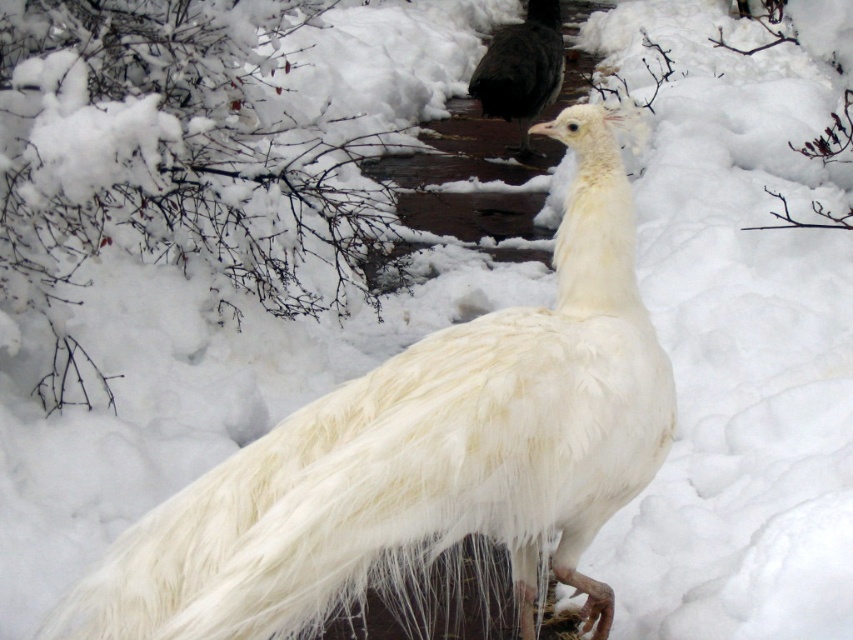
The height and width of the screenshot is (640, 853). I want to click on white feathered peacock at center, so click(x=422, y=452).

Between white feathered peacock at center and black glossy bird at center, which one is positioned higher?

black glossy bird at center

Who is more distant from viewer, [257,460] or [540,68]?

The point [540,68] is behind.

Locate an element on the screen. The width and height of the screenshot is (853, 640). white feathered peacock at center is located at coordinates (422, 452).